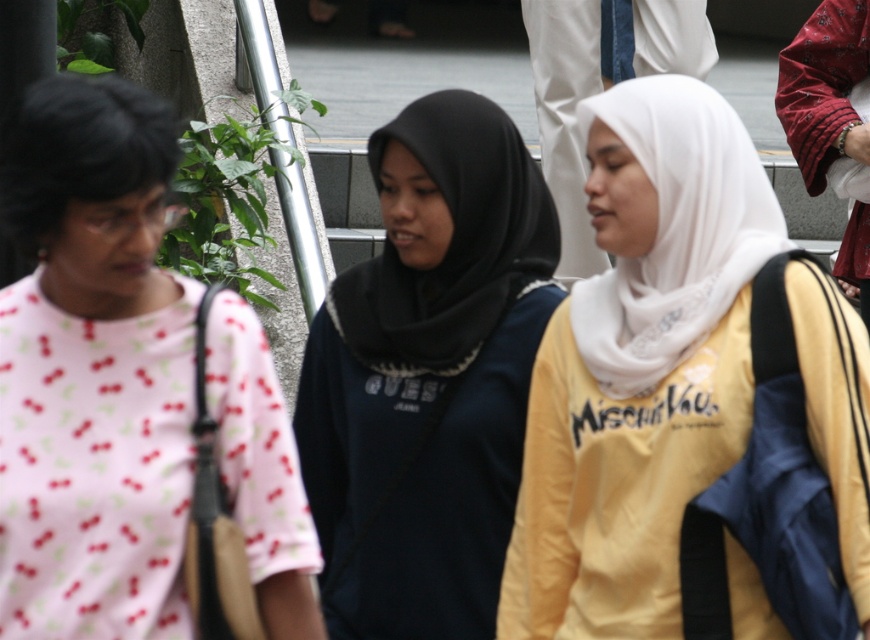
Is white matte hijab at center smaller than black matte hijab at center?

No, white matte hijab at center is not smaller than black matte hijab at center.

Is white matte hijab at center bigger than black matte hijab at center?

Indeed, white matte hijab at center has a larger size compared to black matte hijab at center.

The image size is (870, 640). What do you see at coordinates (640, 365) in the screenshot? I see `white matte hijab at center` at bounding box center [640, 365].

Find the location of a particular element. The height and width of the screenshot is (640, 870). white matte hijab at center is located at coordinates (640, 365).

Is white matte hijab at center smaller than pink printed shirt at left?

No, white matte hijab at center is not smaller than pink printed shirt at left.

Which is behind, point (679, 380) or point (162, 291)?

Point (679, 380)

Locate an element on the screen. The height and width of the screenshot is (640, 870). white matte hijab at center is located at coordinates (640, 365).

Is pink printed shirt at left taller than black matte hijab at center?

Incorrect, pink printed shirt at left's height is not larger of black matte hijab at center's.

Can you confirm if pink printed shirt at left is smaller than black matte hijab at center?

Correct, pink printed shirt at left occupies less space than black matte hijab at center.

This screenshot has height=640, width=870. What do you see at coordinates (92, 369) in the screenshot?
I see `pink printed shirt at left` at bounding box center [92, 369].

Locate an element on the screen. pink printed shirt at left is located at coordinates (92, 369).